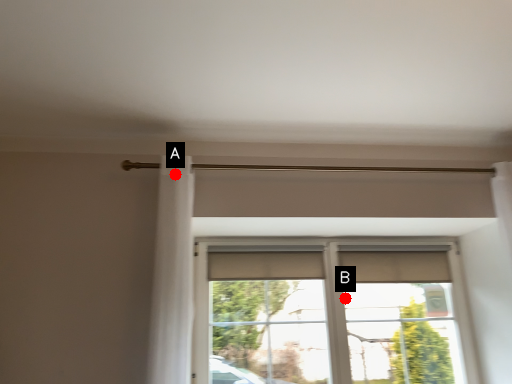
Question: Two points are circled on the image, labeled by A and B beside each circle. Which point is closer to the camera taking this photo?

Choices:
 (A) A is closer
 (B) B is closer

Answer: (A)